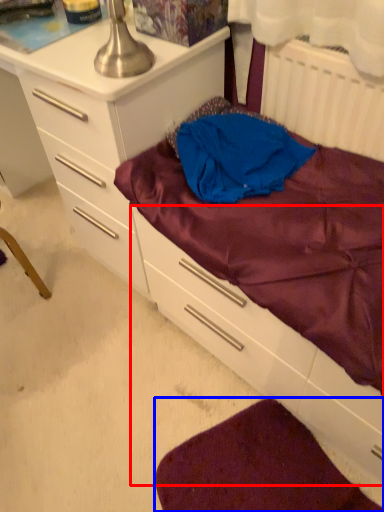
Question: Which point is further to the camera, drawer (highlighted by a red box) or sheet (highlighted by a blue box)?

Choices:
 (A) drawer
 (B) sheet

Answer: (B)